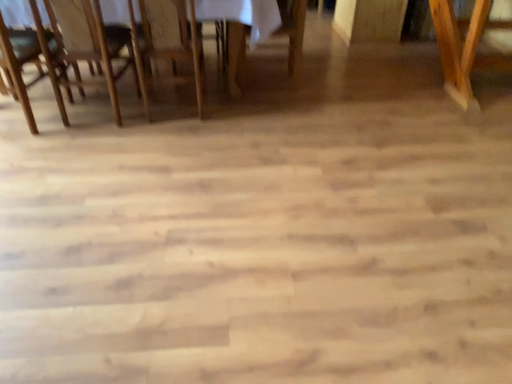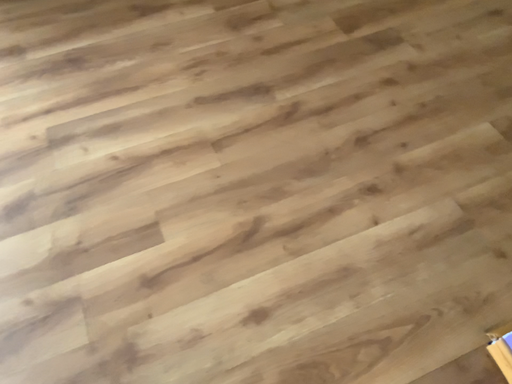
Question: Which way did the camera rotate in the video?

Choices:
 (A) rotated downward
 (B) rotated upward

Answer: (A)